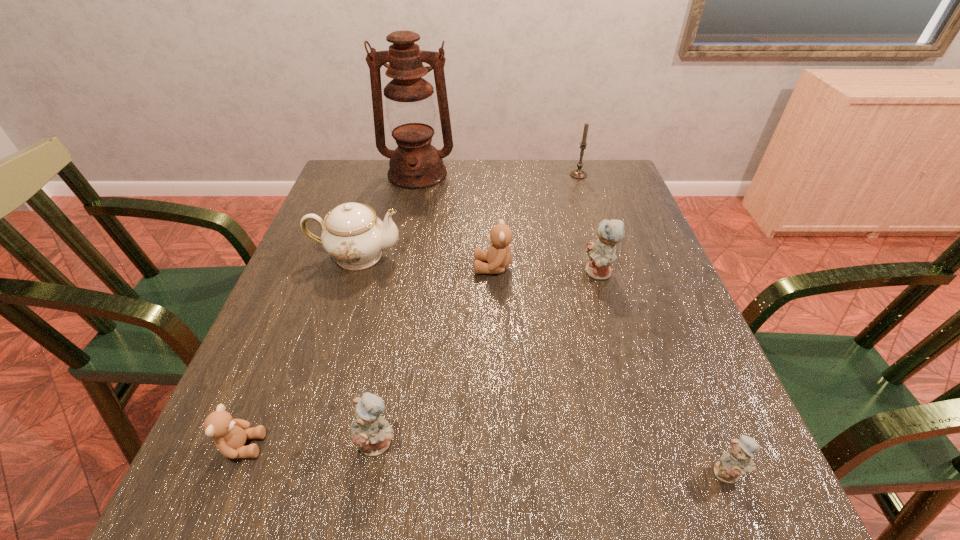
Identify the location of the smaller brown teddy bear. The width and height of the screenshot is (960, 540). (229, 434).

This screenshot has height=540, width=960. I want to click on the rightmost blue teddy bear, so click(737, 461).

Where is `the smallest blue teddy bear`? Image resolution: width=960 pixels, height=540 pixels. the smallest blue teddy bear is located at coordinates (737, 461).

Where is `free space located 0.160m on the front of the oil lamp`? The width and height of the screenshot is (960, 540). free space located 0.160m on the front of the oil lamp is located at coordinates (408, 222).

Where is `vacant space located 0.400m on the front of the candle`? The image size is (960, 540). vacant space located 0.400m on the front of the candle is located at coordinates (608, 267).

Where is `free space located 0.090m on the front-facing side of the second blue teddy bear from left to right`? free space located 0.090m on the front-facing side of the second blue teddy bear from left to right is located at coordinates (545, 273).

Locate an element on the screen. free spot located 0.340m on the front-facing side of the second blue teddy bear from left to right is located at coordinates (438, 273).

Where is `vacant space located 0.110m on the front-facing side of the second blue teddy bear from left to right`? The image size is (960, 540). vacant space located 0.110m on the front-facing side of the second blue teddy bear from left to right is located at coordinates (537, 273).

You are a GUI agent. You are given a task and a screenshot of the screen. Output one action in this format:
    pyautogui.click(x=<x>, y=<y>)
    Task: Click on the vacant space situated at the spout of the chinaware
    
    Given the screenshot: What is the action you would take?
    pyautogui.click(x=510, y=256)

Where is `vacant space located on the face of the fifth object from left to right`? The height and width of the screenshot is (540, 960). vacant space located on the face of the fifth object from left to right is located at coordinates (436, 267).